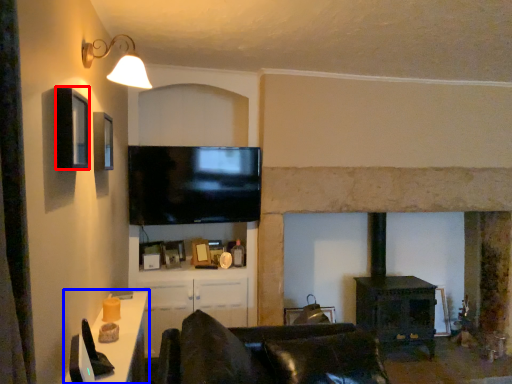
Question: Which of the following is the closest to the observer, window (highlighted by a red box) or table (highlighted by a blue box)?

Choices:
 (A) window
 (B) table

Answer: (B)